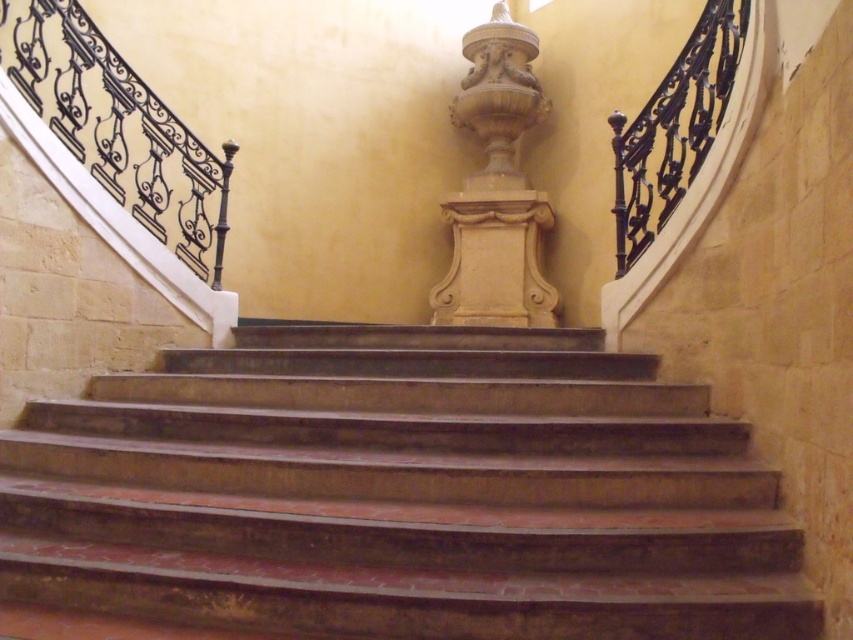
You are standing at the bottom of the brown stone stairs at center and want to reach the black wrought iron railing at upper right. According to the scene, which direction should you move to get closer to the railing?

The brown stone stairs at center is below the black wrought iron railing at upper right, so you should move upward along the brown stone stairs at center to reach the railing.

You are standing at the bottom of the brown stone stairs at center and want to reach the black wrought iron railing at upper right. Which direction should you move to get closer to the railing?

You should move to the right because the brown stone stairs at center is to the left of the black wrought iron railing at upper right, so moving right would bring you closer to the railing.